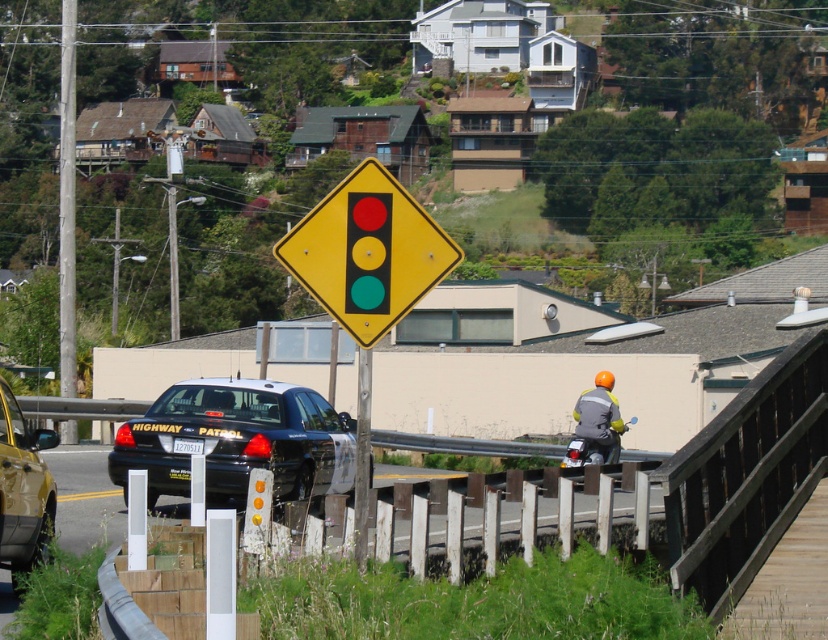
You are a delivery driver who needs to park your truck near the wooden post at left and the metallic pole at center. Given their heights, which object should you avoid parking too close to if you want to ensure your truck won

The wooden post at left has a greater height compared to the metallic pole at center. Therefore, you should avoid parking too close to the wooden post at left to prevent damaging your truck due to its taller structure.

You are a pedestrian standing at point (237,440). What object is located exactly at your current position?

The white glossy highway patrol car at center is located exactly at point (237,440).